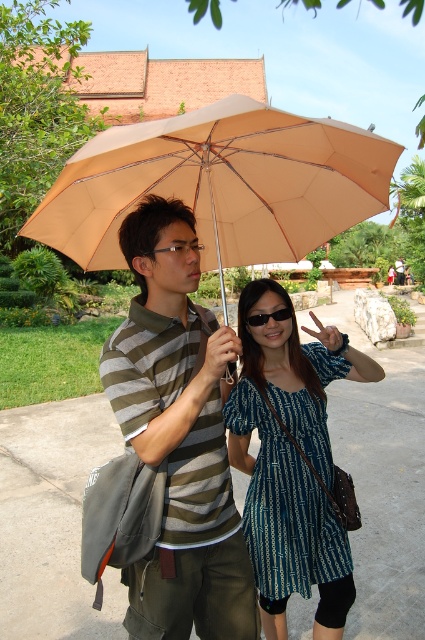
You are a photographer trying to capture a candid shot of the black plastic goggles at center without including the beige fabric umbrella at upper center in the frame. Based on their positions, is this possible?

The beige fabric umbrella at upper center is closer to the viewer than the black plastic goggles at center, so it would block the view of the goggles. Therefore, capturing the goggles without the umbrella in the frame is not possible.

You are standing at the point marked as point (x=178, y=435) in the image. What is the nearest object to you?

The nearest object to you at point (x=178, y=435) is the striped cotton shirt at center.

You are standing at the point marked as point [178,435] in the image. What is the nearest clothing item to you?

The nearest clothing item to point [178,435] is the striped cotton shirt at center.